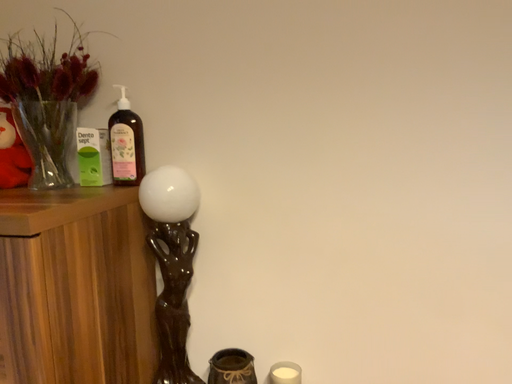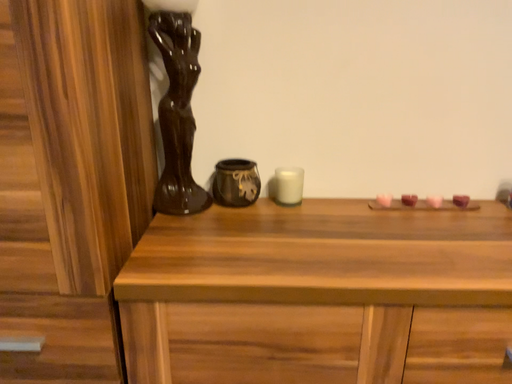
Question: Which way did the camera rotate in the video?

Choices:
 (A) rotated upward
 (B) rotated downward

Answer: (B)